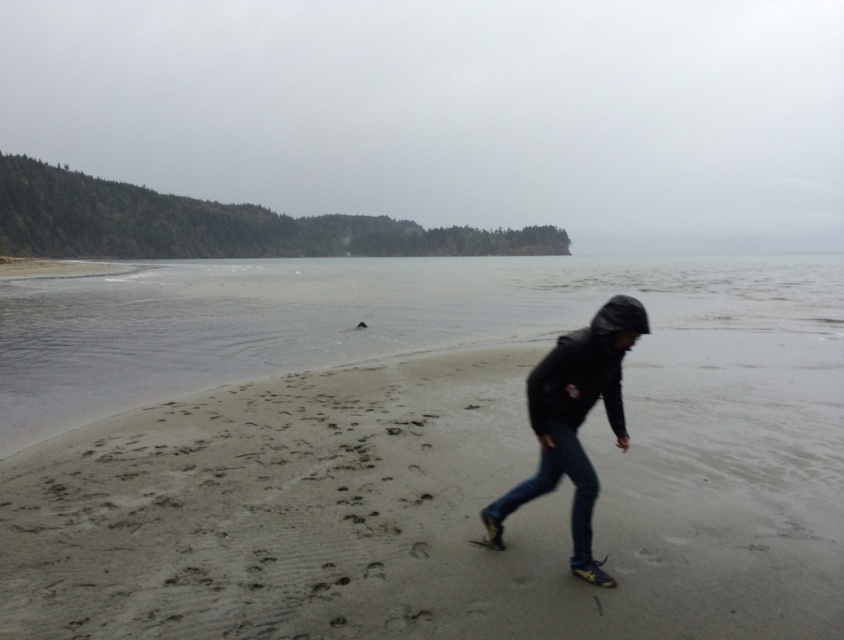
Does sandy beach at center have a lesser width compared to dark blue jeans at lower center?

No.

Can you confirm if sandy beach at center is wider than dark blue jeans at lower center?

Indeed, sandy beach at center has a greater width compared to dark blue jeans at lower center.

This screenshot has height=640, width=844. Describe the element at coordinates (441, 506) in the screenshot. I see `sandy beach at center` at that location.

Find the location of a particular element. The image size is (844, 640). sandy beach at center is located at coordinates (441, 506).